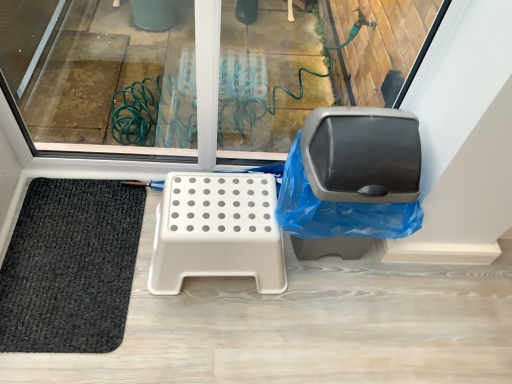
Question: Does matte gray swivel chair at right have a lesser width compared to beige plastic step stool at center?

Choices:
 (A) yes
 (B) no

Answer: (A)

Question: Are matte gray swivel chair at right and beige plastic step stool at center making contact?

Choices:
 (A) no
 (B) yes

Answer: (A)

Question: Could beige plastic step stool at center be considered to be inside matte gray swivel chair at right?

Choices:
 (A) yes
 (B) no

Answer: (B)

Question: From a real-world perspective, is matte gray swivel chair at right physically above beige plastic step stool at center?

Choices:
 (A) yes
 (B) no

Answer: (A)

Question: Does matte gray swivel chair at right have a larger size compared to beige plastic step stool at center?

Choices:
 (A) yes
 (B) no

Answer: (A)

Question: Considering the relative positions of matte gray swivel chair at right and beige plastic step stool at center in the image provided, is matte gray swivel chair at right to the right of beige plastic step stool at center from the viewer's perspective?

Choices:
 (A) yes
 (B) no

Answer: (A)

Question: Could matte gray swivel chair at right be considered to be inside beige plastic step stool at center?

Choices:
 (A) yes
 (B) no

Answer: (B)

Question: Does beige plastic step stool at center have a greater height compared to matte gray swivel chair at right?

Choices:
 (A) yes
 (B) no

Answer: (B)

Question: Can you see beige plastic step stool at center touching matte gray swivel chair at right?

Choices:
 (A) yes
 (B) no

Answer: (B)

Question: Is the depth of beige plastic step stool at center less than that of matte gray swivel chair at right?

Choices:
 (A) no
 (B) yes

Answer: (A)

Question: Does beige plastic step stool at center have a smaller size compared to matte gray swivel chair at right?

Choices:
 (A) yes
 (B) no

Answer: (A)

Question: Considering the relative sizes of beige plastic step stool at center and matte gray swivel chair at right in the image provided, is beige plastic step stool at center shorter than matte gray swivel chair at right?

Choices:
 (A) yes
 (B) no

Answer: (A)

Question: Considering the relative sizes of black woven mat at lower left and matte gray swivel chair at right in the image provided, is black woven mat at lower left shorter than matte gray swivel chair at right?

Choices:
 (A) yes
 (B) no

Answer: (A)